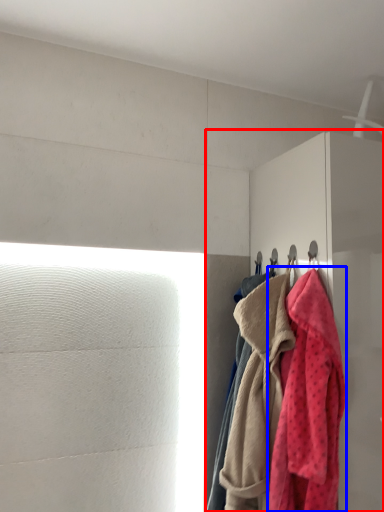
Question: Among these objects, which one is nearest to the camera, dresser (highlighted by a red box) or towel (highlighted by a blue box)?

Choices:
 (A) dresser
 (B) towel

Answer: (B)